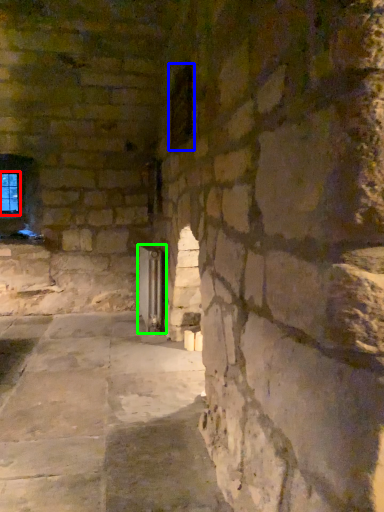
Question: Based on their relative distances, which object is nearer to window (highlighted by a red box)? Choose from window (highlighted by a blue box) and glass door (highlighted by a green box).

Choices:
 (A) window
 (B) glass door

Answer: (B)